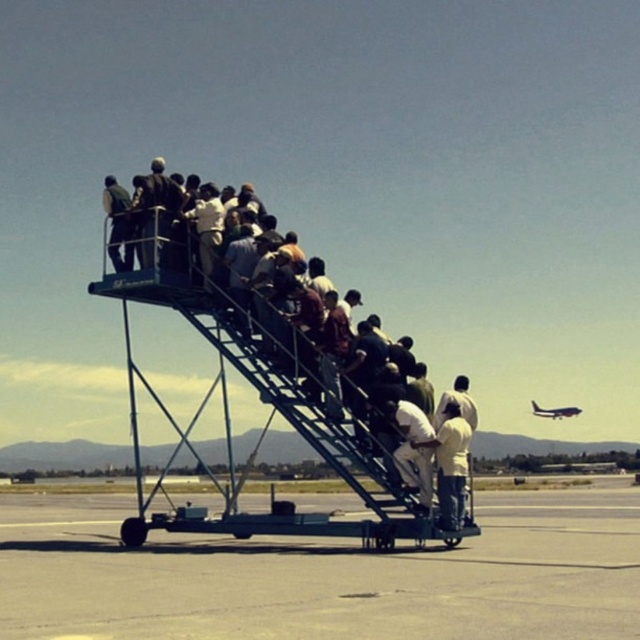
Does smooth concrete tarmac at lower left have a smaller size compared to dark blue metal staircase at center?

Yes, smooth concrete tarmac at lower left is smaller than dark blue metal staircase at center.

Is smooth concrete tarmac at lower left to the left of dark blue metal staircase at center from the viewer's perspective?

Incorrect, smooth concrete tarmac at lower left is not on the left side of dark blue metal staircase at center.

You are a GUI agent. You are given a task and a screenshot of the screen. Output one action in this format:
    pyautogui.click(x=<x>, y=<y>)
    Task: Click on the smooth concrete tarmac at lower left
    The height and width of the screenshot is (640, 640).
    Given the screenshot: What is the action you would take?
    pyautogui.click(x=324, y=577)

Does smooth concrete tarmac at lower left have a lesser width compared to metallic silver airplane at upper right?

In fact, smooth concrete tarmac at lower left might be wider than metallic silver airplane at upper right.

Which is in front, point (442, 636) or point (566, 408)?

Point (442, 636) is in front.

Is point (164, 573) in front of point (572, 408)?

Yes, it is.

Where is `smooth concrete tarmac at lower left`? smooth concrete tarmac at lower left is located at coordinates (324, 577).

Between dark blue metal staircase at center and metallic silver airplane at upper right, which one appears on the right side from the viewer's perspective?

metallic silver airplane at upper right is more to the right.

Can you confirm if dark blue metal staircase at center is positioned below metallic silver airplane at upper right?

No.

Is point (275, 385) farther from camera compared to point (576, 416)?

No, it is in front of (576, 416).

The image size is (640, 640). I want to click on dark blue metal staircase at center, so click(259, 385).